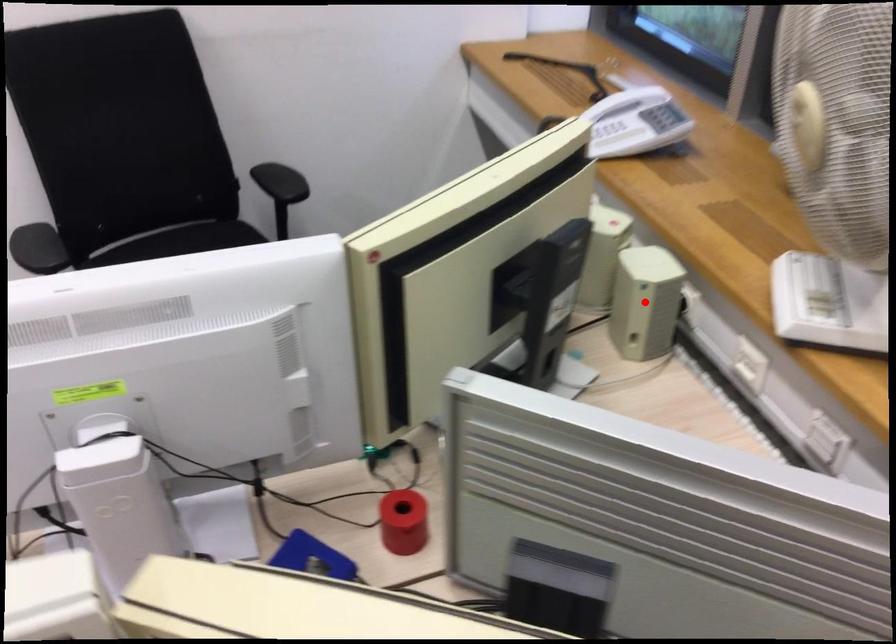
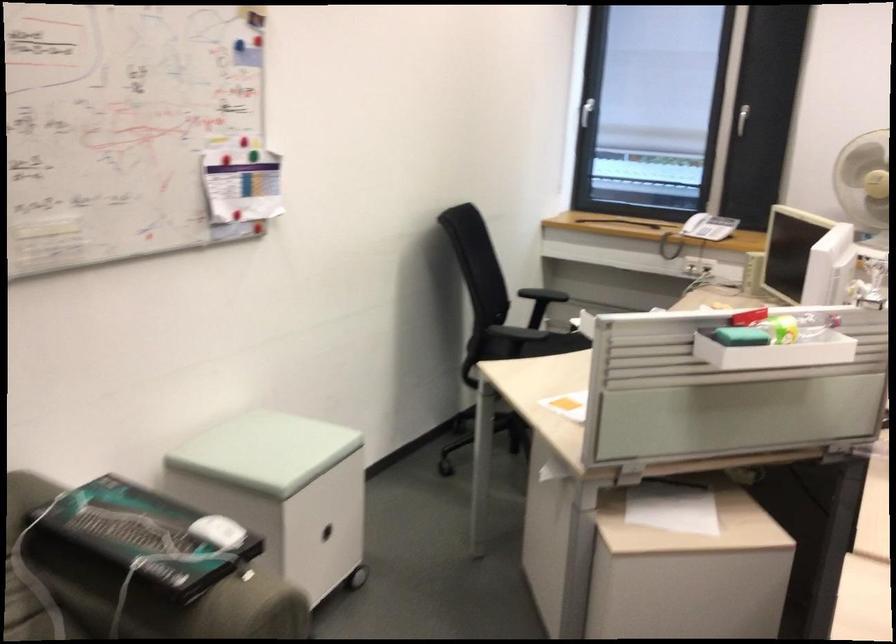
Question: I am providing you with two images of the same scene from different viewpoints. A red point is marked on the first image. Is the red point's position out of view in image 2?

Choices:
 (A) Yes
 (B) No

Answer: (A)